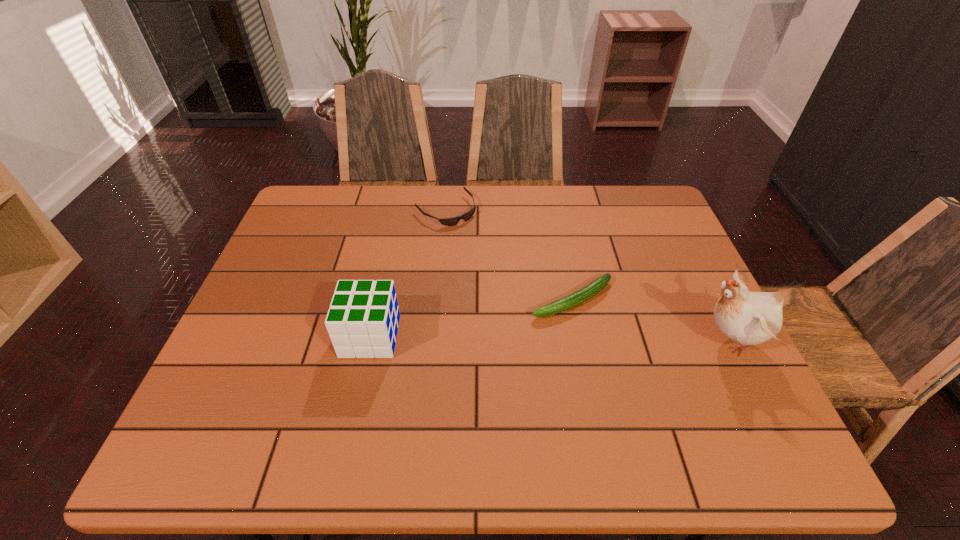
Where is `vacant point located at the beak of the rightmost object`? Image resolution: width=960 pixels, height=540 pixels. vacant point located at the beak of the rightmost object is located at coordinates (632, 340).

Locate an element on the screen. vacant area situated 0.310m at the beak of the rightmost object is located at coordinates (559, 340).

Image resolution: width=960 pixels, height=540 pixels. Identify the location of free space located 0.140m on the front-facing side of the second object from right to left. (489, 334).

Locate an element on the screen. vacant space located 0.270m on the front-facing side of the second object from right to left is located at coordinates (440, 359).

The image size is (960, 540). Find the location of `blank space located on the front-facing side of the second object from right to left`. blank space located on the front-facing side of the second object from right to left is located at coordinates (451, 353).

Find the location of a particular element. The image size is (960, 540). free spot located 0.330m on the front-facing side of the farthest object is located at coordinates (527, 293).

The width and height of the screenshot is (960, 540). I want to click on blank space located on the front-facing side of the farthest object, so click(x=522, y=288).

At what (x,y) coordinates should I click in order to perform the action: click on vacant space situated 0.340m on the front-facing side of the farthest object. Please return your answer as a coordinate pair (x, y). Looking at the image, I should click on (530, 295).

You are a GUI agent. You are given a task and a screenshot of the screen. Output one action in this format:
    pyautogui.click(x=<x>, y=<y>)
    Task: Click on the object that is at the far edge
    The height and width of the screenshot is (540, 960).
    Given the screenshot: What is the action you would take?
    pyautogui.click(x=452, y=221)

Locate an element on the screen. object that is at the near edge is located at coordinates (748, 318).